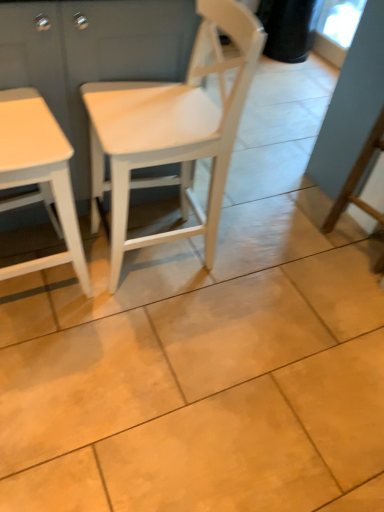
Question: Is white matte table at left not near white wood dresser at left?

Choices:
 (A) yes
 (B) no

Answer: (B)

Question: From the image's perspective, is white matte table at left over white wood dresser at left?

Choices:
 (A) no
 (B) yes

Answer: (A)

Question: From the image's perspective, is white matte table at left beneath white wood dresser at left?

Choices:
 (A) yes
 (B) no

Answer: (A)

Question: Is white matte table at left located outside white wood dresser at left?

Choices:
 (A) no
 (B) yes

Answer: (B)

Question: From a real-world perspective, is white matte table at left located beneath white wood dresser at left?

Choices:
 (A) no
 (B) yes

Answer: (A)

Question: From a real-world perspective, is white matte table at left on white wood dresser at left?

Choices:
 (A) no
 (B) yes

Answer: (B)

Question: Considering the relative sizes of white matte table at left and white matte wood chair at center in the image provided, is white matte table at left wider than white matte wood chair at center?

Choices:
 (A) no
 (B) yes

Answer: (A)

Question: Is white matte table at left not inside white matte wood chair at center?

Choices:
 (A) yes
 (B) no

Answer: (A)

Question: From a real-world perspective, is white matte table at left on white matte wood chair at center?

Choices:
 (A) yes
 (B) no

Answer: (A)

Question: Considering the relative sizes of white matte table at left and white matte wood chair at center in the image provided, is white matte table at left shorter than white matte wood chair at center?

Choices:
 (A) no
 (B) yes

Answer: (B)

Question: Considering the relative sizes of white matte table at left and white matte wood chair at center in the image provided, is white matte table at left thinner than white matte wood chair at center?

Choices:
 (A) yes
 (B) no

Answer: (A)

Question: From the image's perspective, is white matte table at left on white matte wood chair at center?

Choices:
 (A) no
 (B) yes

Answer: (A)

Question: Does white wood dresser at left have a larger size compared to white matte wood chair at center?

Choices:
 (A) yes
 (B) no

Answer: (A)